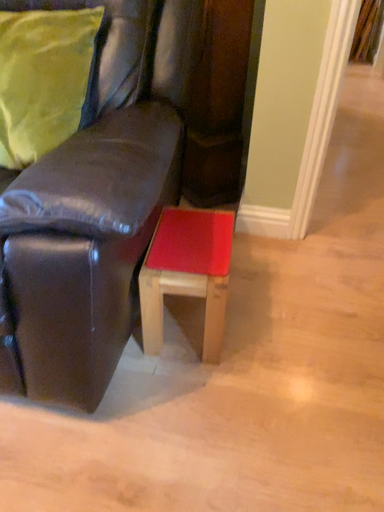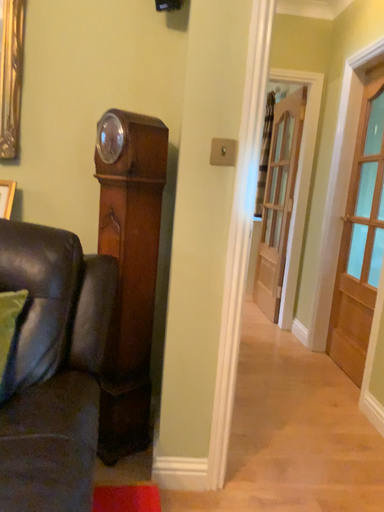
Question: Which way did the camera rotate in the video?

Choices:
 (A) rotated downward
 (B) rotated upward

Answer: (B)